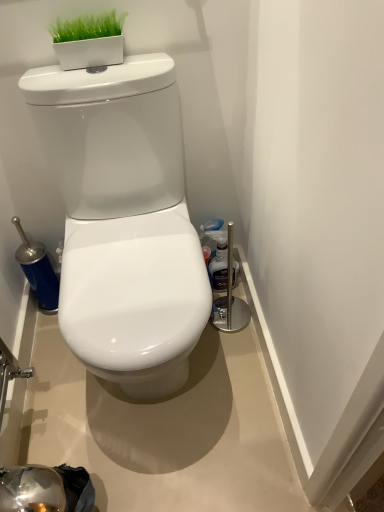
Question: Is point (235, 274) positioned closer to the camera than point (72, 148)?

Choices:
 (A) closer
 (B) farther

Answer: (B)

Question: In terms of height, does clear plastic bottle at right look taller or shorter compared to white glossy toilet at center?

Choices:
 (A) short
 (B) tall

Answer: (A)

Question: Would you say clear plastic bottle at right is to the left or to the right of white glossy toilet at center in the picture?

Choices:
 (A) right
 (B) left

Answer: (A)

Question: Choose the correct answer: Is white glossy toilet at center inside clear plastic bottle at right or outside it?

Choices:
 (A) outside
 (B) inside

Answer: (A)

Question: Is white glossy toilet at center bigger or smaller than clear plastic bottle at right?

Choices:
 (A) small
 (B) big

Answer: (B)

Question: Considering the positions of point (175, 211) and point (210, 278), is point (175, 211) closer or farther from the camera than point (210, 278)?

Choices:
 (A) closer
 (B) farther

Answer: (A)

Question: Is white glossy toilet at center taller or shorter than clear plastic bottle at right?

Choices:
 (A) short
 (B) tall

Answer: (B)